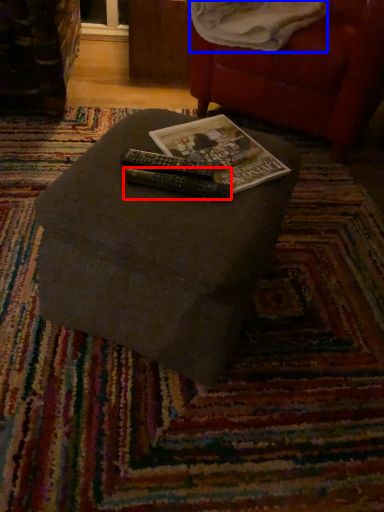
Question: Which object appears closest to the camera in this image, remote (highlighted by a red box) or blanket (highlighted by a blue box)?

Choices:
 (A) remote
 (B) blanket

Answer: (A)